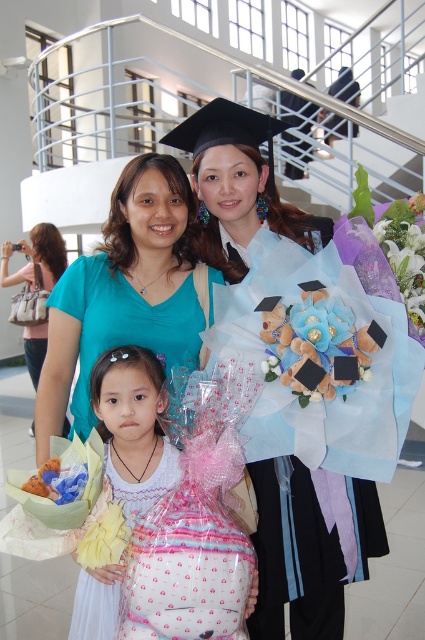
Does pink fabric gift bag at center have a greater width compared to matte teal shirt at center?

In fact, pink fabric gift bag at center might be narrower than matte teal shirt at center.

Describe the element at coordinates (127, 408) in the screenshot. Image resolution: width=425 pixels, height=640 pixels. I see `pink fabric gift bag at center` at that location.

Locate an element on the screen. The width and height of the screenshot is (425, 640). pink fabric gift bag at center is located at coordinates (127, 408).

Is point (107, 436) positioned before point (90, 596)?

No, it is not.

Is pink fabric gift bag at center smaller than pink polka dot dress at center?

Yes.

Who is more distant from viewer, [116,568] or [85,636]?

Point [85,636]

Find the location of a particular element. This screenshot has width=425, height=640. pink fabric gift bag at center is located at coordinates (127, 408).

Who is taller, matte black graduation gown at center or pink polka dot dress at center?

matte black graduation gown at center is taller.

Between matte black graduation gown at center and pink polka dot dress at center, which one appears on the right side from the viewer's perspective?

From the viewer's perspective, matte black graduation gown at center appears more on the right side.

At what (x,y) coordinates should I click in order to perform the action: click on matte black graduation gown at center. Please return your answer as a coordinate pair (x, y). The height and width of the screenshot is (640, 425). Looking at the image, I should click on (311, 547).